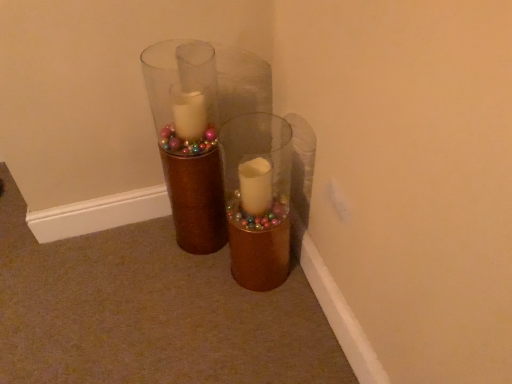
Where is `free point in front of brown textured vase at center, the first vase when ordered from right to left`? free point in front of brown textured vase at center, the first vase when ordered from right to left is located at coordinates (259, 315).